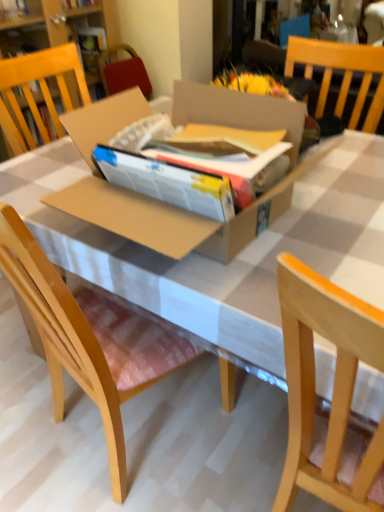
Question: Is light wood chair at right, acting as the 1th chair starting from the right, at the left side of wooden chair at center, which is the 2th chair in right-to-left order?

Choices:
 (A) no
 (B) yes

Answer: (A)

Question: Is light wood chair at right, the 2th chair from the left, wider than wooden chair at center, which ranks as the first chair in left-to-right order?

Choices:
 (A) no
 (B) yes

Answer: (B)

Question: From a real-world perspective, is light wood chair at right, acting as the 1th chair starting from the right, over wooden chair at center, which ranks as the first chair in left-to-right order?

Choices:
 (A) no
 (B) yes

Answer: (B)

Question: Can you confirm if light wood chair at right, the 2th chair from the left, is thinner than wooden chair at center, which is the 2th chair in right-to-left order?

Choices:
 (A) yes
 (B) no

Answer: (B)

Question: Is light wood chair at right, the 2th chair from the left, positioned with its back to wooden chair at center, which is the 2th chair in right-to-left order?

Choices:
 (A) no
 (B) yes

Answer: (A)

Question: Considering the relative sizes of light wood chair at right, acting as the 1th chair starting from the right, and wooden chair at center, which ranks as the first chair in left-to-right order, in the image provided, is light wood chair at right, acting as the 1th chair starting from the right, bigger than wooden chair at center, which ranks as the first chair in left-to-right order,?

Choices:
 (A) no
 (B) yes

Answer: (A)

Question: Is brown cardboard box at center positioned in front of light wood chair at right, the 2th chair from the left?

Choices:
 (A) yes
 (B) no

Answer: (B)

Question: Does brown cardboard box at center lie behind light wood chair at right, acting as the 1th chair starting from the right?

Choices:
 (A) no
 (B) yes

Answer: (B)

Question: Is light wood chair at right, acting as the 1th chair starting from the right, completely or partially inside brown cardboard box at center?

Choices:
 (A) no
 (B) yes

Answer: (A)

Question: Is brown cardboard box at center oriented towards light wood chair at right, the 2th chair from the left?

Choices:
 (A) yes
 (B) no

Answer: (A)

Question: Is brown cardboard box at center placed right next to light wood chair at right, acting as the 1th chair starting from the right?

Choices:
 (A) no
 (B) yes

Answer: (A)

Question: Considering the relative sizes of brown cardboard box at center and light wood chair at right, the 2th chair from the left, in the image provided, is brown cardboard box at center thinner than light wood chair at right, the 2th chair from the left,?

Choices:
 (A) yes
 (B) no

Answer: (B)

Question: From a real-world perspective, is wooden chair at center, which is the 2th chair in right-to-left order, on light wood chair at right, the 2th chair from the left?

Choices:
 (A) no
 (B) yes

Answer: (A)